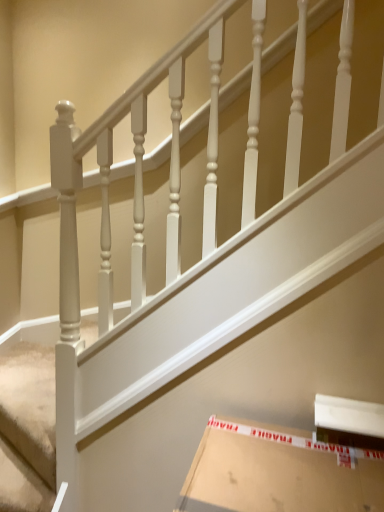
Image resolution: width=384 pixels, height=512 pixels. In order to click on blank space situated above white textured carpet at lower left (from a real-world perspective) in this screenshot , I will do `click(36, 397)`.